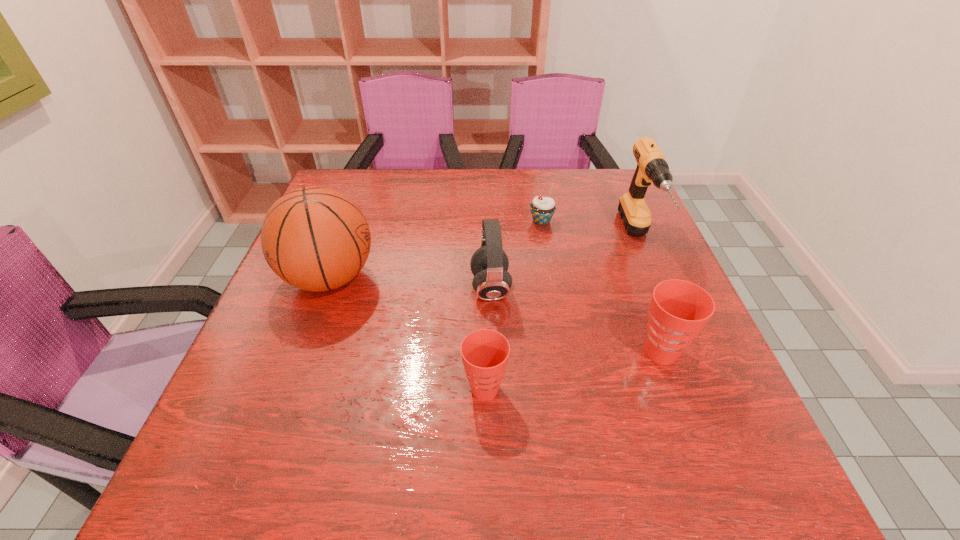
Locate an element on the screen. The width and height of the screenshot is (960, 540). vacant space situated 0.160m at the tip of the drill is located at coordinates (677, 329).

At what (x,y) coordinates should I click in order to perform the action: click on vacant area located on the ear cups of the headset. Please return your answer as a coordinate pair (x, y). This screenshot has height=540, width=960. Looking at the image, I should click on (344, 288).

Find the location of a particular element. vacant space situated 0.340m on the ear cups of the headset is located at coordinates (323, 288).

Where is `vacant space located on the ear cups of the headset`? vacant space located on the ear cups of the headset is located at coordinates (331, 288).

What are the coordinates of `vacant space situated on the front of the basketball` in the screenshot? It's located at (291, 384).

Find the location of a particular element. The width and height of the screenshot is (960, 540). vacant region located on the front of the shortest object is located at coordinates (545, 245).

Image resolution: width=960 pixels, height=540 pixels. What are the coordinates of `object that is at the far edge` in the screenshot? It's located at (652, 167).

The height and width of the screenshot is (540, 960). In order to click on object that is at the near edge in this screenshot , I will do `click(485, 352)`.

You are a GUI agent. You are given a task and a screenshot of the screen. Output one action in this format:
    pyautogui.click(x=<x>, y=<y>)
    Task: Click on the object present at the left edge
    This screenshot has width=960, height=540.
    Given the screenshot: What is the action you would take?
    pyautogui.click(x=314, y=238)

Where is `cup positioned at the right edge`? Image resolution: width=960 pixels, height=540 pixels. cup positioned at the right edge is located at coordinates (679, 309).